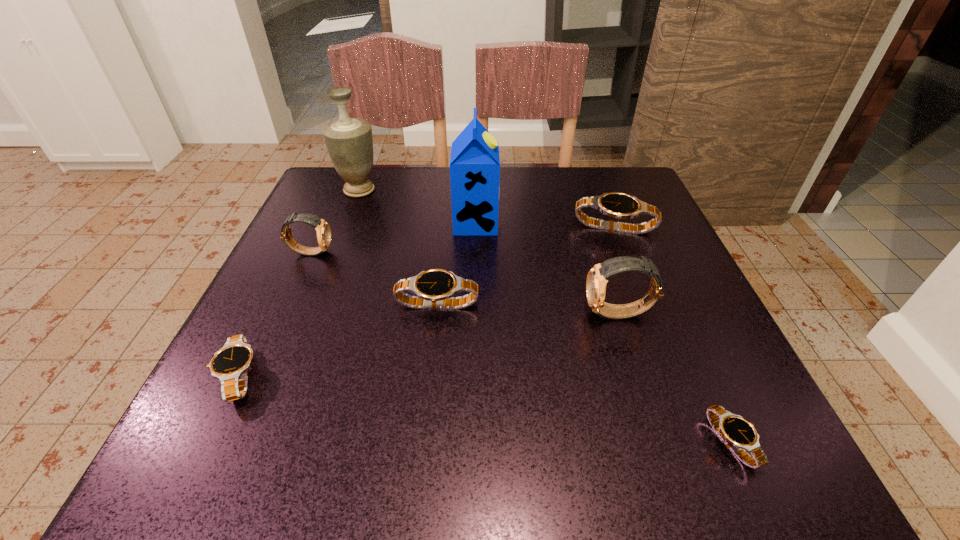
The image size is (960, 540). What are the coordinates of `the farthest object` in the screenshot? It's located at (349, 141).

Find the location of `blue carton`. blue carton is located at coordinates (474, 163).

I want to click on the nearer gold watch, so click(597, 278).

The image size is (960, 540). I want to click on the sixth shortest object, so click(x=597, y=278).

Image resolution: width=960 pixels, height=540 pixels. I want to click on the farther gold watch, so click(x=323, y=230).

Image resolution: width=960 pixels, height=540 pixels. What are the coordinates of `the fourth tallest object` in the screenshot? It's located at click(323, 230).

The image size is (960, 540). Identify the location of the farthest black watch. (618, 205).

This screenshot has height=540, width=960. What are the coordinates of `the fifth tallest object` in the screenshot? It's located at (618, 205).

Where is `the second farthest black watch`? The image size is (960, 540). the second farthest black watch is located at coordinates (431, 287).

Where is `the fourth watch from right to left`? the fourth watch from right to left is located at coordinates (431, 287).